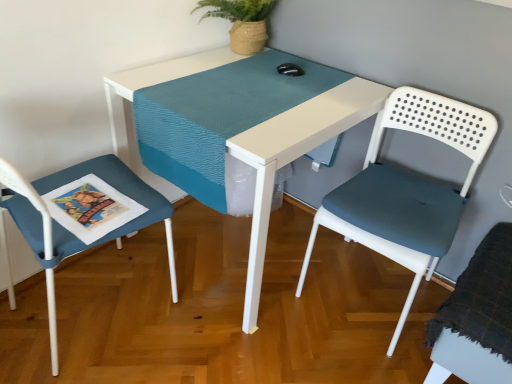
Identify the location of vacant space underneath textured blue cushion at left, which is the third chair from right to left (from a real-world perspective). (101, 311).